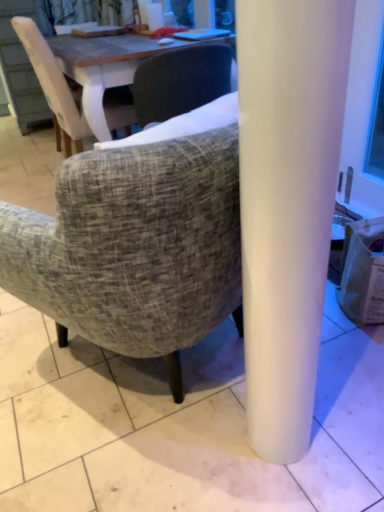
Question: Based on their positions, is light brown fabric chair at upper left, the 1th chair when ordered from back to front, located to the left or right of textured fabric chair at center, the 1th chair positioned from the right?

Choices:
 (A) right
 (B) left

Answer: (B)

Question: Looking at their shapes, would you say light brown fabric chair at upper left, the second chair positioned from the bottom, is wider or thinner than textured fabric chair at center, the first chair ordered from the bottom?

Choices:
 (A) wide
 (B) thin

Answer: (A)

Question: Which is farther from the brown paper bag at lower right?

Choices:
 (A) textured fabric chair at center, the 1th chair positioned from the right
 (B) light brown fabric chair at upper left, the 2th chair in the front-to-back sequence

Answer: (B)

Question: Estimate the real-world distances between objects in this image. Which object is closer to the textured fabric chair at center, placed as the second chair when sorted from left to right?

Choices:
 (A) light brown fabric chair at upper left, which appears as the 1th chair when viewed from the left
 (B) brown paper bag at lower right

Answer: (B)